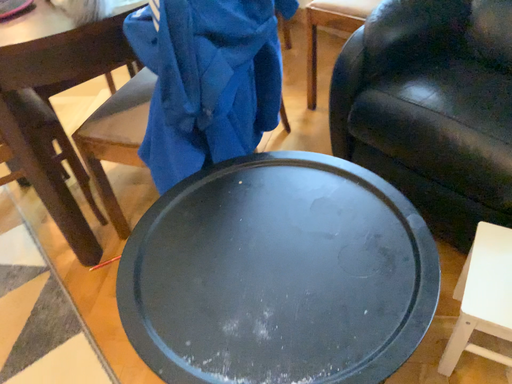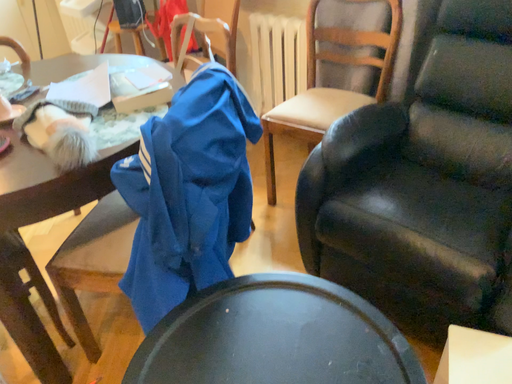
Question: How did the camera likely rotate when shooting the video?

Choices:
 (A) rotated upward
 (B) rotated downward

Answer: (A)